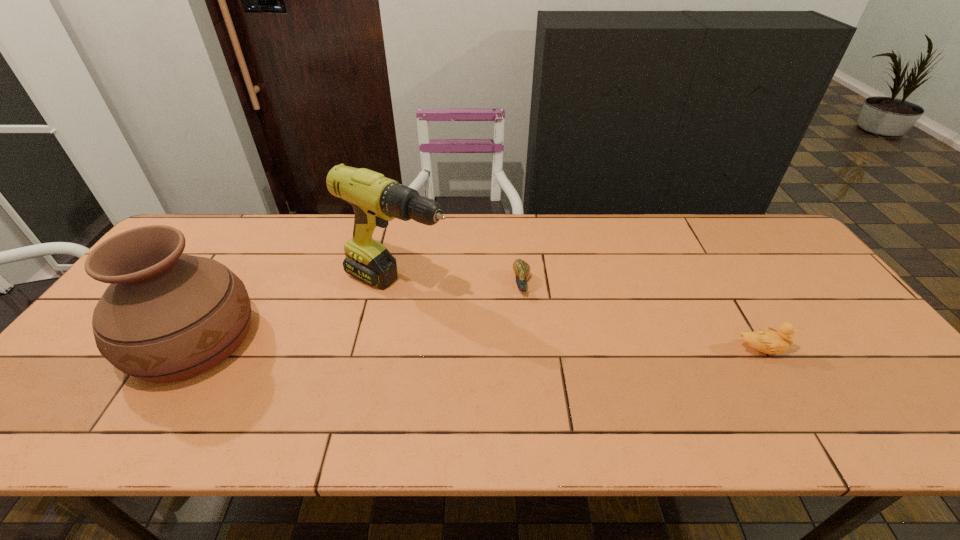
The width and height of the screenshot is (960, 540). I want to click on free point that satisfies the following two spatial constraints: 1. on the front side of the escargot; 2. on the face of the rightmost object, so click(x=528, y=350).